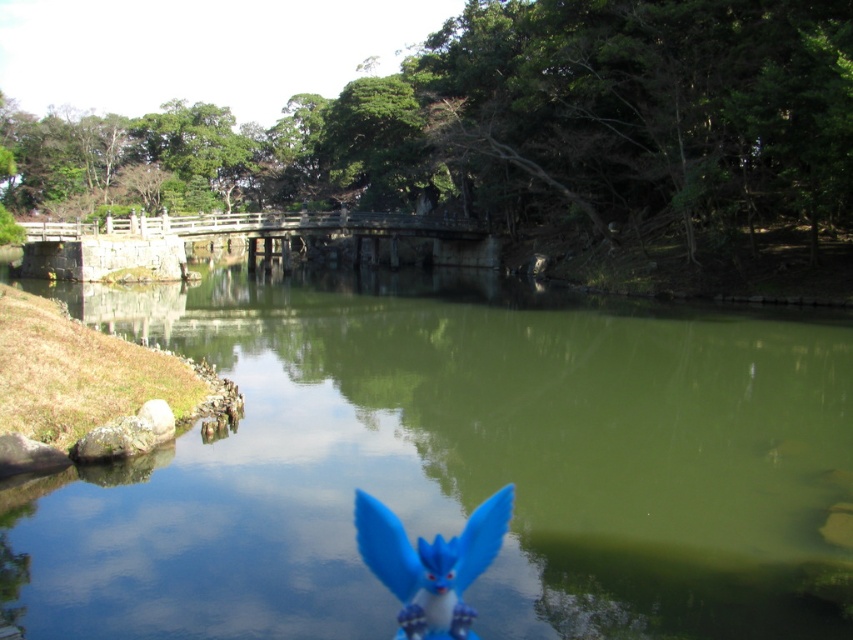
Is point (461, 449) more distant than point (444, 566)?

Yes, it is.

Is point (0, 557) closer to camera compared to point (480, 550)?

No.

At what (x,y) coordinates should I click in order to perform the action: click on green matte water at center. Please return your answer as a coordinate pair (x, y). Looking at the image, I should click on (457, 465).

Which is above, green matte water at center or stone bridge at center?

Positioned higher is stone bridge at center.

Is green matte water at center to the right of stone bridge at center from the viewer's perspective?

Yes, green matte water at center is to the right of stone bridge at center.

Does point (177, 541) come closer to viewer compared to point (440, 236)?

Yes, point (177, 541) is closer to viewer.

At what (x,y) coordinates should I click in order to perform the action: click on green matte water at center. Please return your answer as a coordinate pair (x, y). Looking at the image, I should click on (457, 465).

Who is taller, stone bridge at center or blue matte toy at center?

stone bridge at center

Measure the distance between stone bridge at center and camera.

Result: 43.77 meters

Is point (445, 237) more distant than point (459, 538)?

Yes, it is.

I want to click on stone bridge at center, so click(x=231, y=234).